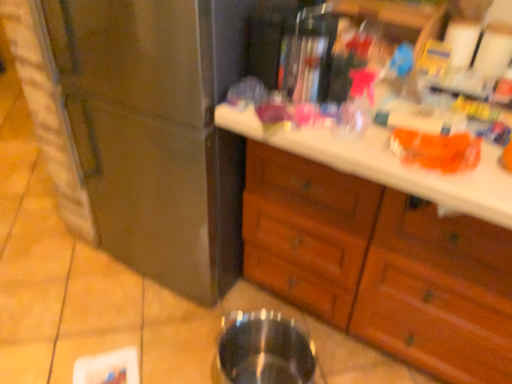
Where is `free point behind transparent glass at lower center`? This screenshot has width=512, height=384. free point behind transparent glass at lower center is located at coordinates (245, 310).